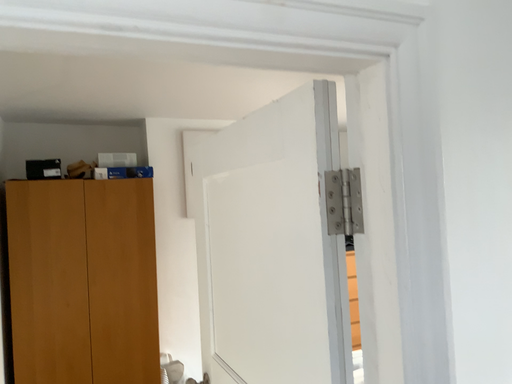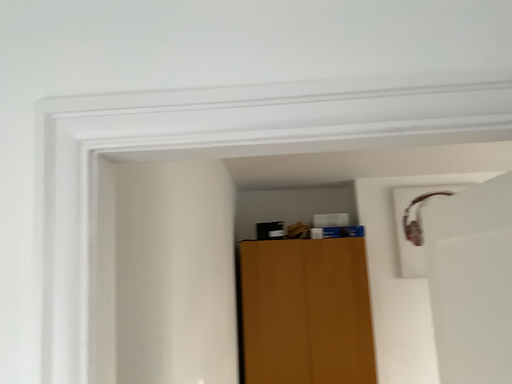
Question: Which way did the camera rotate in the video?

Choices:
 (A) rotated upward
 (B) rotated downward

Answer: (A)